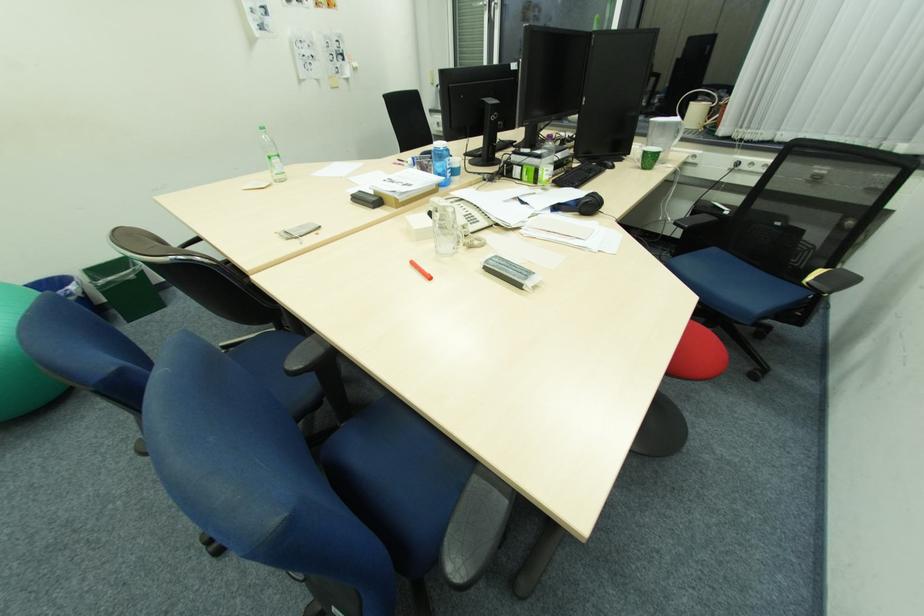
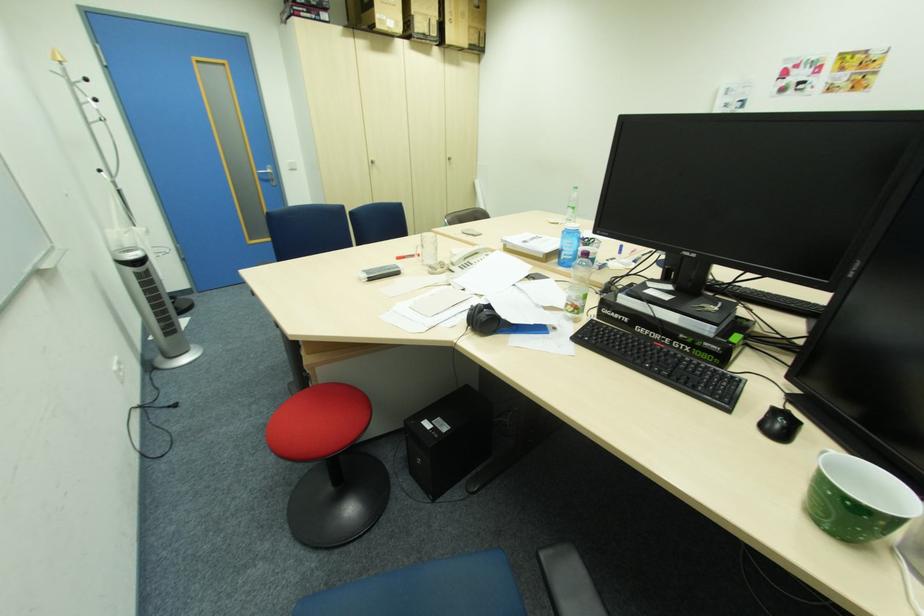
Question: I am providing you with two images of the same scene from different viewpoints. Please identify which objects are invisible in image2.

Choices:
 (A) silver door handle
 (B) black mesh trashcan
 (C) set of keys
 (D) black headphones

Answer: (D)